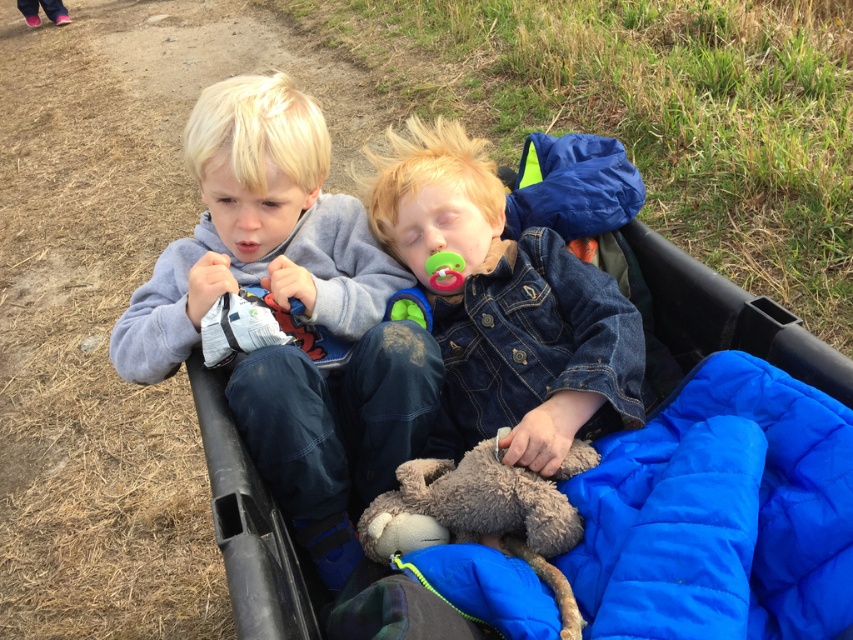
Question: Does black plastic baby carriage at center appear on the right side of green plush toy at center?

Choices:
 (A) no
 (B) yes

Answer: (B)

Question: Does gray fleece hoodie at left have a smaller size compared to rubber pacifier at center?

Choices:
 (A) yes
 (B) no

Answer: (B)

Question: Can you confirm if black plastic baby carriage at center is positioned below rubber pacifier at center?

Choices:
 (A) yes
 (B) no

Answer: (A)

Question: Estimate the real-world distances between objects in this image. Which object is closer to the denim jacket at center?

Choices:
 (A) gray plush toy at center
 (B) black plastic baby carriage at center
 (C) gray fleece hoodie at left
 (D) rubber pacifier at center

Answer: (D)

Question: Which point appears farthest from the camera in this image?

Choices:
 (A) (451, 280)
 (B) (587, 452)

Answer: (A)

Question: Which of the following is the farthest from the observer?

Choices:
 (A) (523, 506)
 (B) (291, 186)

Answer: (B)